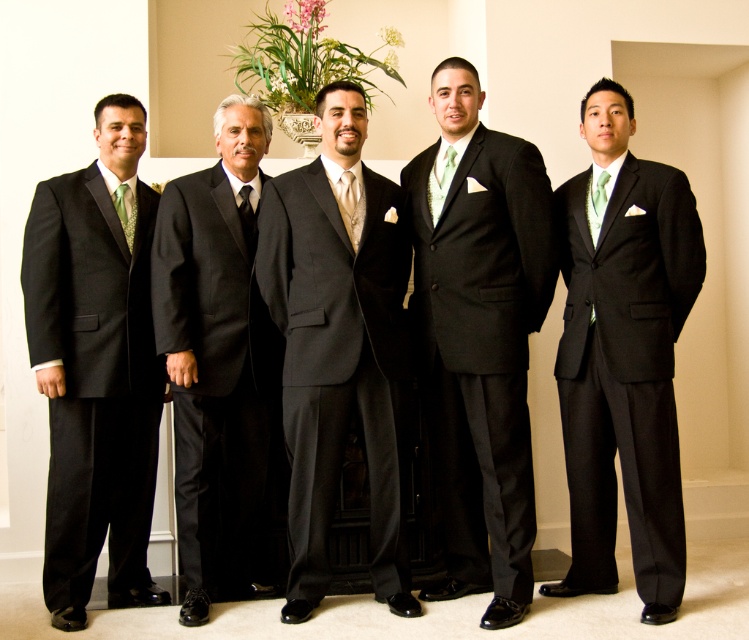
Question: Is matte black suit at center smaller than black silk tie at center?

Choices:
 (A) yes
 (B) no

Answer: (B)

Question: Among these points, which one is nearest to the camera?

Choices:
 (A) (133, 244)
 (B) (342, 189)
 (C) (197, 225)

Answer: (B)

Question: From the image, what is the correct spatial relationship of matte black suit at left in relation to black satin suit at center?

Choices:
 (A) above
 (B) below

Answer: (B)

Question: Does matte black suit at center have a greater width compared to black satin suit at center?

Choices:
 (A) no
 (B) yes

Answer: (B)

Question: Estimate the real-world distances between objects in this image. Which object is closer to the matte black suit at center?

Choices:
 (A) black satin suit at center
 (B) green textured tie at left
 (C) black silk tie at center

Answer: (A)

Question: Which is farther from the black satin suit at center?

Choices:
 (A) green satin tie at center
 (B) black silk tie at center
 (C) matte black suit at center
 (D) satin green tie at center

Answer: (A)